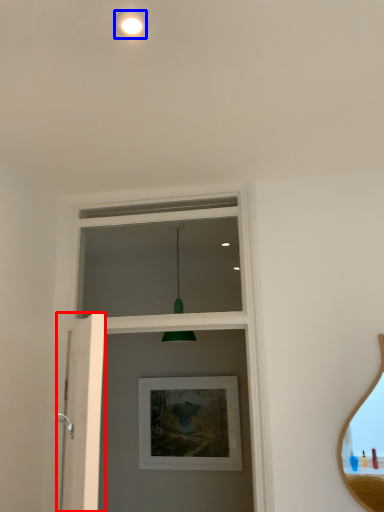
Question: Which of the following is the closest to the observer, screen door (highlighted by a red box) or droplight (highlighted by a blue box)?

Choices:
 (A) screen door
 (B) droplight

Answer: (B)